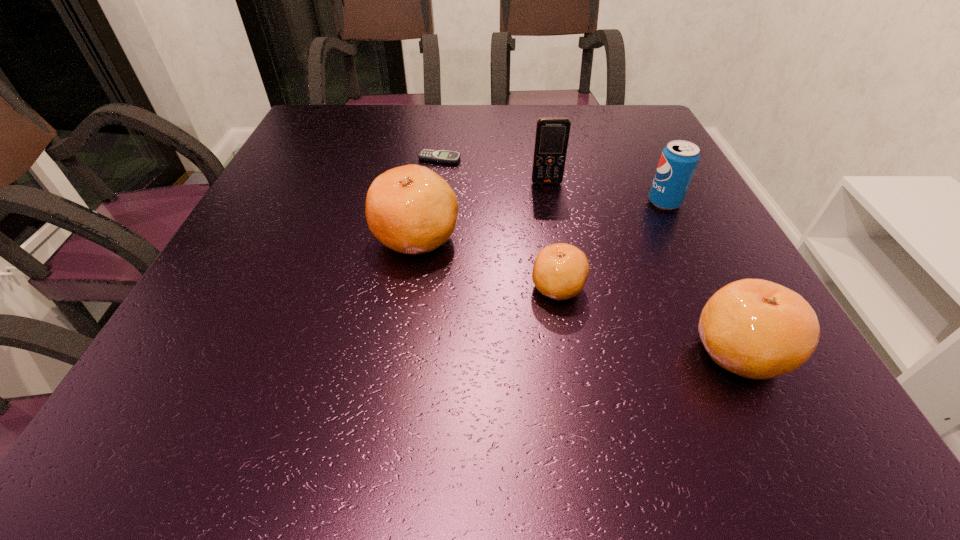
The height and width of the screenshot is (540, 960). Find the location of `vacant space at the near edge of the desktop`. vacant space at the near edge of the desktop is located at coordinates (543, 330).

Identify the location of vacant region at the left edge of the desktop. (293, 223).

The image size is (960, 540). What are the coordinates of `vacant space at the right edge` in the screenshot? It's located at (686, 211).

Where is `free space at the far left corner of the desktop`? The width and height of the screenshot is (960, 540). free space at the far left corner of the desktop is located at coordinates (338, 135).

This screenshot has height=540, width=960. I want to click on free spot at the near left corner of the desktop, so click(x=222, y=346).

I want to click on free space between the cellular telephone and the second tallest clementine, so click(x=643, y=267).

Find the location of a particular element. empty location between the farthest object and the rightmost clementine is located at coordinates (589, 255).

Where is `vacant region between the cellular telephone and the nearest object`? vacant region between the cellular telephone and the nearest object is located at coordinates (643, 267).

Identify the location of blank region between the fifth tallest object and the soda can. (612, 245).

Locate an element on the screen. free space between the fifth tallest object and the farthest clementine is located at coordinates (487, 262).